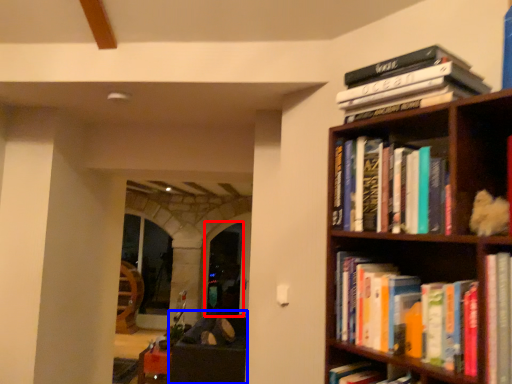
Question: Among these objects, which one is nearest to the camera, glass door (highlighted by a red box) or furniture (highlighted by a blue box)?

Choices:
 (A) glass door
 (B) furniture

Answer: (B)